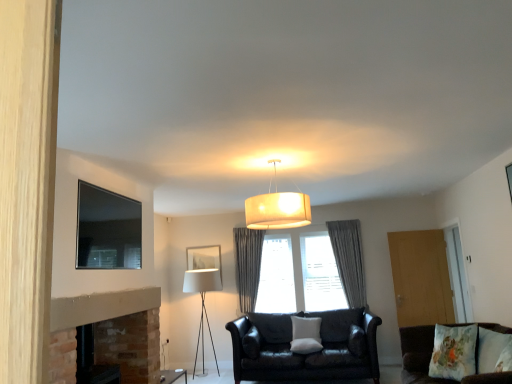
From the picture: Measure the distance between white fabric lampshade at lower left and camera.

The depth of white fabric lampshade at lower left is 20.96 feet.

Locate an element on the screen. The height and width of the screenshot is (384, 512). white fabric picture frame at center, positioned as the 2th picture frame in left-to-right order is located at coordinates tap(204, 258).

Image resolution: width=512 pixels, height=384 pixels. What do you see at coordinates (304, 269) in the screenshot?
I see `gray fabric curtain at center` at bounding box center [304, 269].

Measure the distance between point [485,335] and camera.

Point [485,335] and camera are 3.83 meters apart from each other.

Where is `transparent glass door at right, which ranks as the first glass door in right-to-left order`? This screenshot has height=384, width=512. transparent glass door at right, which ranks as the first glass door in right-to-left order is located at coordinates (457, 274).

The image size is (512, 384). I want to click on gray fabric curtain at center, which is counted as the first curtain, starting from the right, so click(x=349, y=259).

Consider the image. Is white fabric pillow at center, placed as the first pillow when sorted from back to front, not inside matte black couch at center, acting as the second studio couch starting from the front?

No, white fabric pillow at center, placed as the first pillow when sorted from back to front, is not outside of matte black couch at center, acting as the second studio couch starting from the front.

Between point (291, 346) and point (232, 334), which one is positioned behind?

The point (232, 334) is farther from the camera.

Based on the photo, how many degrees apart are the facing directions of white fabric pillow at center, placed as the first pillow when sorted from back to front, and matte black couch at center, the first studio couch viewed from the back?

There is a 0.000218-degree angle between the facing directions of white fabric pillow at center, placed as the first pillow when sorted from back to front, and matte black couch at center, the first studio couch viewed from the back.

From their relative heights in the image, would you say white fabric pillow at center, which is the 2th pillow from top to bottom, is taller or shorter than matte black couch at center, acting as the second studio couch starting from the front?

In the image, white fabric pillow at center, which is the 2th pillow from top to bottom, appears to be shorter than matte black couch at center, acting as the second studio couch starting from the front.

From a real-world perspective, count 1st picture frames downward from the matte white fabric lampshade at center and point to it. Please provide its 2D coordinates.

[(106, 229)]

Is matte black tv at upper left, the second picture frame ordered from the bottom, facing towards matte white fabric lampshade at center?

Yes, matte black tv at upper left, the second picture frame ordered from the bottom, is oriented towards matte white fabric lampshade at center.

Is white fabric pillow at center, positioned as the second pillow in front-to-back order, touching gray fabric curtain at center?

No.

Is point (298, 349) closer to viewer compared to point (329, 270)?

Yes, point (298, 349) is closer to viewer.

Between white fabric pillow at center, the 2th pillow from the right, and gray fabric curtain at center, which one has more height?

With more height is gray fabric curtain at center.

Does white fabric pillow at center, placed as the first pillow when sorted from back to front, have a smaller size compared to gray fabric curtain at center?

Yes, white fabric pillow at center, placed as the first pillow when sorted from back to front, is smaller than gray fabric curtain at center.

How many degrees apart are the facing directions of wooden door at right, which is the first glass door from left to right, and gray fabric curtain at center, marked as the second curtain in a left-to-right arrangement?

The facing directions of wooden door at right, which is the first glass door from left to right, and gray fabric curtain at center, marked as the second curtain in a left-to-right arrangement, are 4.52 degrees apart.

Is wooden door at right, the second glass door positioned from the right, positioned far away from gray fabric curtain at center, marked as the second curtain in a left-to-right arrangement?

They are positioned close to each other.

From a real-world perspective, does wooden door at right, which is the first glass door from left to right, stand above gray fabric curtain at center, marked as the second curtain in a left-to-right arrangement?

Actually, wooden door at right, which is the first glass door from left to right, is physically below gray fabric curtain at center, marked as the second curtain in a left-to-right arrangement, in the real world.

Is wooden door at right, which is the first glass door from left to right, shorter than gray fabric curtain at center, marked as the second curtain in a left-to-right arrangement?

Indeed, wooden door at right, which is the first glass door from left to right, has a lesser height compared to gray fabric curtain at center, marked as the second curtain in a left-to-right arrangement.

From the image's perspective, is white fabric picture frame at center, the first picture frame ordered from the bottom, on top of matte black couch at center, acting as the second studio couch starting from the front?

Yes, from the image's perspective, white fabric picture frame at center, the first picture frame ordered from the bottom, is over matte black couch at center, acting as the second studio couch starting from the front.

Is point (193, 266) closer to camera compared to point (257, 375)?

No, (193, 266) is further to viewer.

How much distance is there between white fabric picture frame at center, the first picture frame ordered from the bottom, and matte black couch at center, the first studio couch viewed from the back?

A distance of 1.83 meters exists between white fabric picture frame at center, the first picture frame ordered from the bottom, and matte black couch at center, the first studio couch viewed from the back.

Is white fabric picture frame at center, marked as the 1th picture frame in a back-to-front arrangement, positioned with its back to matte black couch at center, acting as the second studio couch starting from the front?

No, matte black couch at center, acting as the second studio couch starting from the front, is not at the back of white fabric picture frame at center, marked as the 1th picture frame in a back-to-front arrangement.

From the image's perspective, who appears lower, matte white fabric lampshade at center or gray fabric curtain at center, marked as the second curtain in a left-to-right arrangement?

From the image's view, gray fabric curtain at center, marked as the second curtain in a left-to-right arrangement, is below.

Are matte white fabric lampshade at center and gray fabric curtain at center, marked as the second curtain in a left-to-right arrangement, far apart?

That's right, there is a large distance between matte white fabric lampshade at center and gray fabric curtain at center, marked as the second curtain in a left-to-right arrangement.

Considering the sizes of objects matte white fabric lampshade at center and gray fabric curtain at center, which is counted as the first curtain, starting from the right, in the image provided, who is wider, matte white fabric lampshade at center or gray fabric curtain at center, which is counted as the first curtain, starting from the right,?

Wider between the two is matte white fabric lampshade at center.

Considering the sizes of objects matte white fabric lampshade at center and gray fabric curtain at center, which is counted as the first curtain, starting from the right, in the image provided, who is shorter, matte white fabric lampshade at center or gray fabric curtain at center, which is counted as the first curtain, starting from the right,?

matte white fabric lampshade at center is shorter.

Could you measure the distance between transparent glass door at right, which ranks as the second glass door in left-to-right order, and white fabric lampshade at lower left?

The distance of transparent glass door at right, which ranks as the second glass door in left-to-right order, from white fabric lampshade at lower left is 3.42 meters.

Is transparent glass door at right, which ranks as the second glass door in left-to-right order, aimed at white fabric lampshade at lower left?

Yes, transparent glass door at right, which ranks as the second glass door in left-to-right order, is oriented towards white fabric lampshade at lower left.

Is point (457, 317) more distant than point (204, 269)?

No.

Based on the photo, which object is closer to the camera, transparent glass door at right, which ranks as the first glass door in right-to-left order, or white fabric lampshade at lower left?

Positioned in front is transparent glass door at right, which ranks as the first glass door in right-to-left order.

From a real-world perspective, count 1st pillows upward from the matte black couch at center, the first studio couch viewed from the back, and point to it. Please provide its 2D coordinates.

[(306, 335)]

Where is `lamp above the matte black tv at upper left, the second picture frame ordered from the bottom (from the image's perspective)`? lamp above the matte black tv at upper left, the second picture frame ordered from the bottom (from the image's perspective) is located at coordinates (277, 208).

Based on their spatial positions, is matte black couch at center, acting as the second studio couch starting from the front, or gray fabric curtain at center, placed as the 2th curtain when sorted from right to left, closer to matte white fabric lampshade at center?

The object closer to matte white fabric lampshade at center is matte black couch at center, acting as the second studio couch starting from the front.

Which object lies nearer to the anchor point transparent glass door at right, which ranks as the first glass door in right-to-left order, white fabric lampshade at lower left or gray fabric curtain at center?

gray fabric curtain at center lies closer to transparent glass door at right, which ranks as the first glass door in right-to-left order, than the other object.

Looking at the image, which one is located further to wooden door at right, which is the first glass door from left to right, white fabric lampshade at lower left or velvet brown couch at lower right, which is the 1th studio couch from front to back?

white fabric lampshade at lower left is positioned further to the anchor wooden door at right, which is the first glass door from left to right.

Looking at the image, which one is located closer to matte black couch at center, acting as the second studio couch starting from the front, matte black side table at lower left or white fabric picture frame at center, the first picture frame in the right-to-left sequence?

matte black side table at lower left lies closer to matte black couch at center, acting as the second studio couch starting from the front, than the other object.

From the image, which object appears to be farther from gray fabric curtain at center, velvet brown couch at lower right, which is the 1th studio couch from front to back, or white fabric pillow at center, placed as the first pillow when sorted from back to front?

velvet brown couch at lower right, which is the 1th studio couch from front to back, lies further to gray fabric curtain at center than the other object.

Looking at this image, estimate the real-world distances between objects in this image. Which object is closer to matte white fabric lampshade at center, matte black tv at upper left, acting as the second picture frame starting from the right, or wooden door at right, which is the first glass door from left to right?

Among the two, matte black tv at upper left, acting as the second picture frame starting from the right, is located nearer to matte white fabric lampshade at center.

Which object lies further to the anchor point white fabric picture frame at center, the first picture frame in the right-to-left sequence, transparent glass door at right, which ranks as the first glass door in right-to-left order, or matte black couch at center, the first studio couch viewed from the back?

transparent glass door at right, which ranks as the first glass door in right-to-left order, is further to white fabric picture frame at center, the first picture frame in the right-to-left sequence.

When comparing their distances from gray fabric curtain at center, marked as the second curtain in a left-to-right arrangement, does matte white fabric lampshade at center or velvet brown couch at lower right, which is the 1th studio couch from front to back, seem further?

matte white fabric lampshade at center.

Where is `pillow between fluffy floral pillow at lower right, the 2th pillow viewed from the left, and white fabric lampshade at lower left, along the z-axis`? This screenshot has width=512, height=384. pillow between fluffy floral pillow at lower right, the 2th pillow viewed from the left, and white fabric lampshade at lower left, along the z-axis is located at coordinates (306, 335).

At what (x,y) coordinates should I click in order to perform the action: click on lamp located between velvet brown couch at lower right, which is counted as the 2th studio couch, starting from the back, and matte black couch at center, acting as the second studio couch starting from the front, in the depth direction. Please return your answer as a coordinate pair (x, y). The height and width of the screenshot is (384, 512). Looking at the image, I should click on (277, 208).

Locate an element on the screen. table lamp between matte black tv at upper left, the 1th picture frame positioned from the front, and gray fabric curtain at center, marked as the second curtain in a left-to-right arrangement, from front to back is located at coordinates (202, 304).

Find the location of a particular element. The width and height of the screenshot is (512, 384). lamp between gray fabric curtain at center, positioned as the first curtain in left-to-right order, and transparent glass door at right, which ranks as the first glass door in right-to-left order is located at coordinates (277, 208).